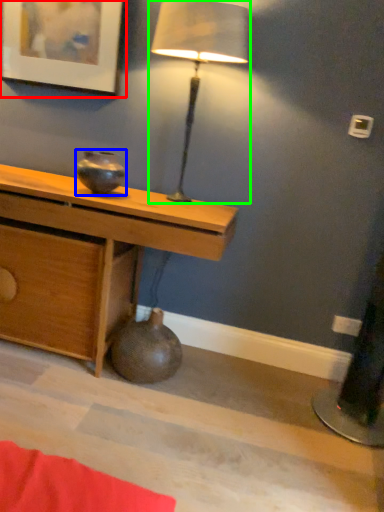
Question: Based on their relative distances, which object is nearer to picture frame (highlighted by a red box)? Choose from vase (highlighted by a blue box) and lamp (highlighted by a green box).

Choices:
 (A) vase
 (B) lamp

Answer: (B)